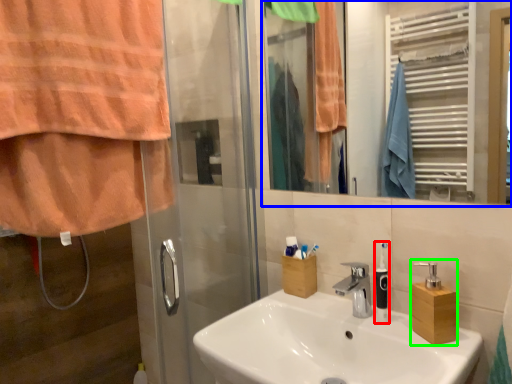
Question: Which object is the farthest from soap dispenser (highlighted by a red box)? Choose among these: mirror (highlighted by a blue box) or soap dispenser (highlighted by a green box).

Choices:
 (A) mirror
 (B) soap dispenser

Answer: (A)